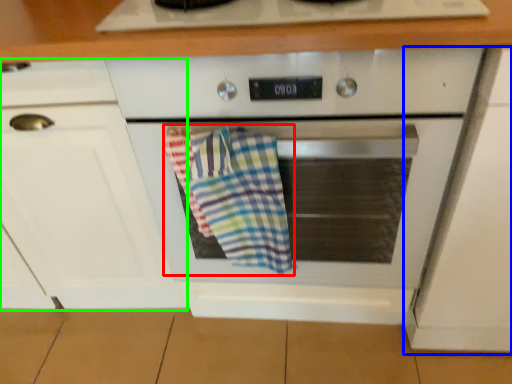
Question: Estimate the real-world distances between objects in this image. Which object is closer to beach towel (highlighted by a red box), cabinetry (highlighted by a blue box) or cabinetry (highlighted by a green box)?

Choices:
 (A) cabinetry
 (B) cabinetry

Answer: (B)